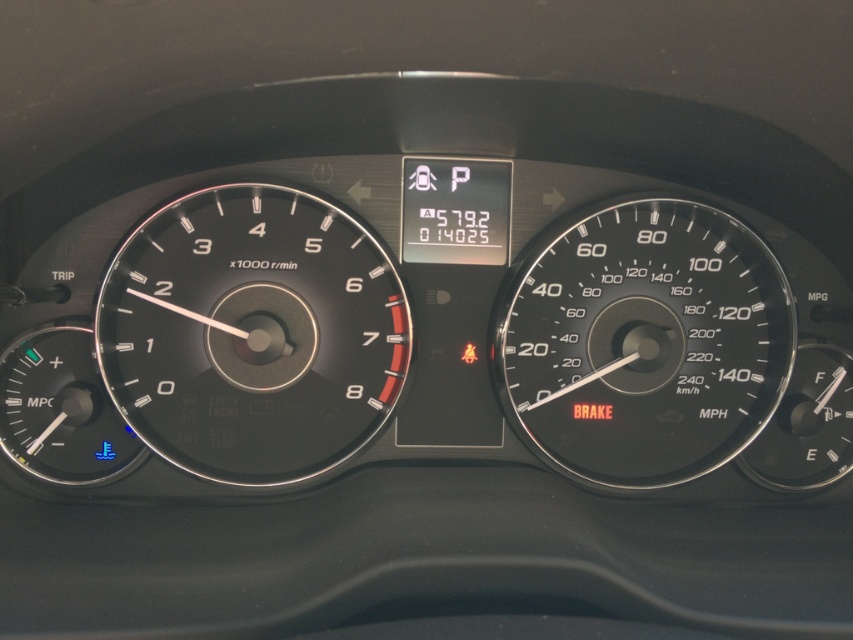
Question: Is black matte speedometer at center bigger than black plastic speedometer at center right?

Choices:
 (A) yes
 (B) no

Answer: (A)

Question: Which object is farther from the camera taking this photo?

Choices:
 (A) black plastic speedometer at center right
 (B) black matte speedometer at center

Answer: (A)

Question: Which point is farther to the camera?

Choices:
 (A) black plastic speedometer at center right
 (B) black matte speedometer at center

Answer: (A)

Question: Is black matte speedometer at center wider than black plastic speedometer at center right?

Choices:
 (A) no
 (B) yes

Answer: (A)

Question: Does black matte speedometer at center lie behind black plastic speedometer at center right?

Choices:
 (A) yes
 (B) no

Answer: (B)